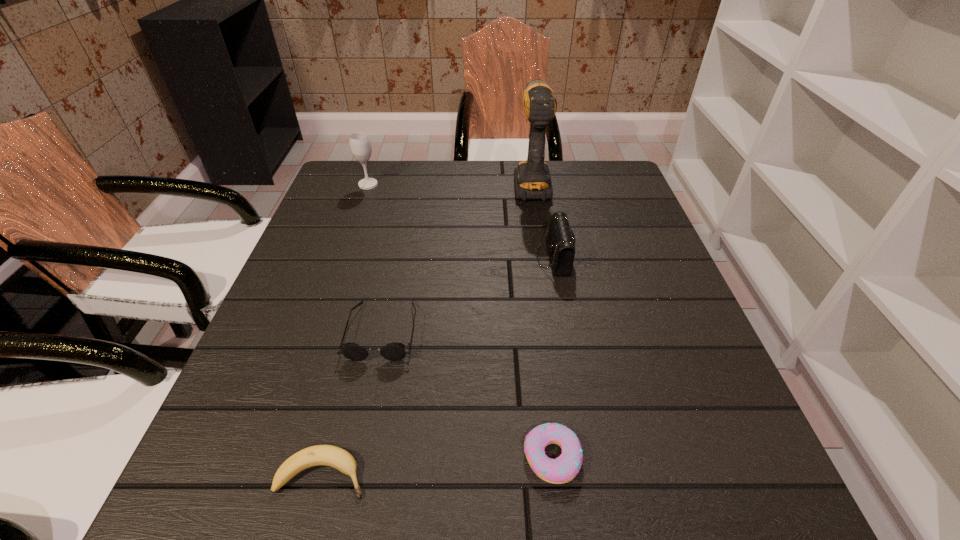
Where is `free space located 0.050m on the front flap of the clutch bag`? The width and height of the screenshot is (960, 540). free space located 0.050m on the front flap of the clutch bag is located at coordinates coord(516,258).

This screenshot has width=960, height=540. Find the location of `vacant point located 0.160m on the front flap of the clutch bag`. vacant point located 0.160m on the front flap of the clutch bag is located at coordinates (468, 258).

Where is `free spot located on the front-facing side of the fourth tallest object`? The image size is (960, 540). free spot located on the front-facing side of the fourth tallest object is located at coordinates tap(368, 401).

Find the location of a particular element. free space located 0.270m on the right of the doughnut is located at coordinates (758, 457).

The height and width of the screenshot is (540, 960). I want to click on vacant region located 0.070m at the stem of the banana, so click(x=415, y=475).

Find the location of a particular element. This screenshot has height=540, width=960. drill located at the far edge is located at coordinates (532, 179).

Image resolution: width=960 pixels, height=540 pixels. What are the coordinates of `wineglass situated at the far edge` in the screenshot? It's located at (360, 145).

This screenshot has width=960, height=540. In order to click on doughnut located in the near edge section of the desktop in this screenshot , I will do `click(563, 469)`.

Where is `banana that is at the near edge`? The height and width of the screenshot is (540, 960). banana that is at the near edge is located at coordinates 327,455.

Identify the location of wineglass that is positioned at the left edge. This screenshot has height=540, width=960. (360, 145).